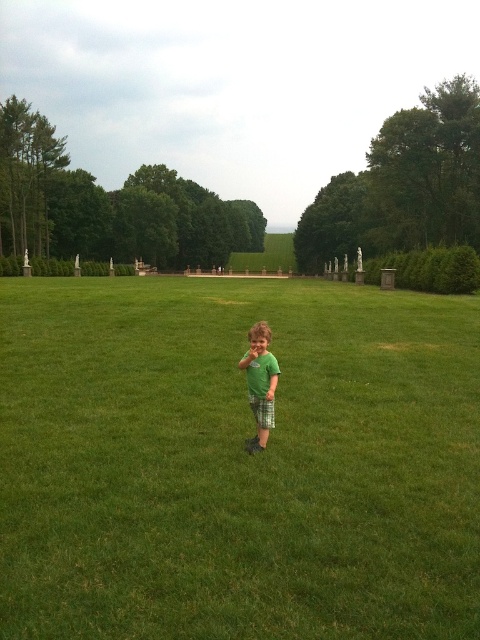
Question: Which of the following is the closest to the observer?

Choices:
 (A) (262, 422)
 (B) (0, 413)

Answer: (A)

Question: Can you confirm if green grass at center is wider than green matte shirt at center?

Choices:
 (A) no
 (B) yes

Answer: (B)

Question: Considering the relative positions of green grass at center and green matte shirt at center in the image provided, where is green grass at center located with respect to green matte shirt at center?

Choices:
 (A) below
 (B) above

Answer: (B)

Question: Which object is closer to the camera taking this photo?

Choices:
 (A) green grass at center
 (B) green matte shirt at center

Answer: (A)

Question: Does green grass at center appear on the left side of green matte shirt at center?

Choices:
 (A) yes
 (B) no

Answer: (B)